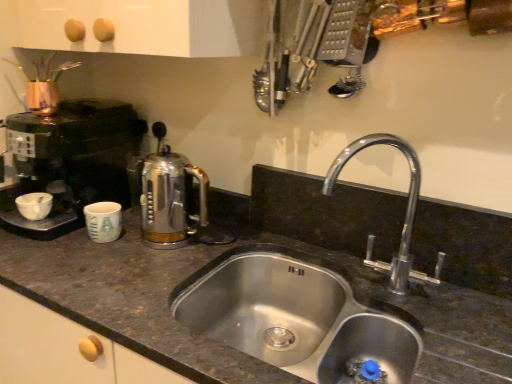
Question: In the image, is stainless steel sink at center positioned in front of or behind satin chrome coffee pot at center?

Choices:
 (A) behind
 (B) front

Answer: (B)

Question: From a real-world perspective, is stainless steel sink at center above or below satin chrome coffee pot at center?

Choices:
 (A) above
 (B) below

Answer: (B)

Question: Which is nearer to the black plastic coffee machine at left?

Choices:
 (A) stainless steel sink at center
 (B) matte ceramic mug at left
 (C) chrome metallic faucet at center right
 (D) satin chrome coffee pot at center
 (E) white glossy bowl at left

Answer: (E)

Question: Estimate the real-world distances between objects in this image. Which object is farther from the satin chrome coffee pot at center?

Choices:
 (A) matte ceramic mug at left
 (B) black plastic coffee machine at left
 (C) stainless steel sink at center
 (D) white glossy bowl at left
 (E) chrome metallic faucet at center right

Answer: (E)